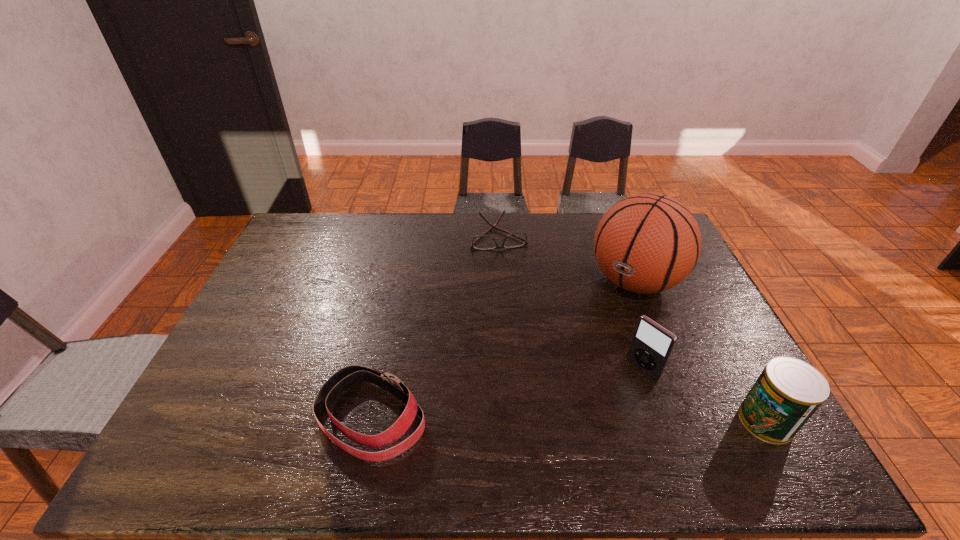
Locate an element on the screen. This screenshot has height=540, width=960. dog collar is located at coordinates (345, 378).

This screenshot has height=540, width=960. Identify the location of the fourth tallest object. pyautogui.click(x=345, y=378).

Image resolution: width=960 pixels, height=540 pixels. I want to click on can, so click(788, 392).

What are the coordinates of `spectacles` in the screenshot? It's located at (x=518, y=239).

Where is `the shortest object`? Image resolution: width=960 pixels, height=540 pixels. the shortest object is located at coordinates (518, 239).

Image resolution: width=960 pixels, height=540 pixels. I want to click on iPod, so click(651, 346).

Locate an element on the screen. This screenshot has height=540, width=960. the fourth nearest object is located at coordinates (646, 243).

Locate an element on the screen. the tallest object is located at coordinates (646, 243).

The height and width of the screenshot is (540, 960). I want to click on free region located on the back of the leftmost object, so click(x=395, y=303).

You are a GUI agent. You are given a task and a screenshot of the screen. Output one action in this format:
    pyautogui.click(x=<x>, y=<y>)
    Task: Click on the vacant area located on the left of the can
    
    Given the screenshot: What is the action you would take?
    pyautogui.click(x=699, y=421)